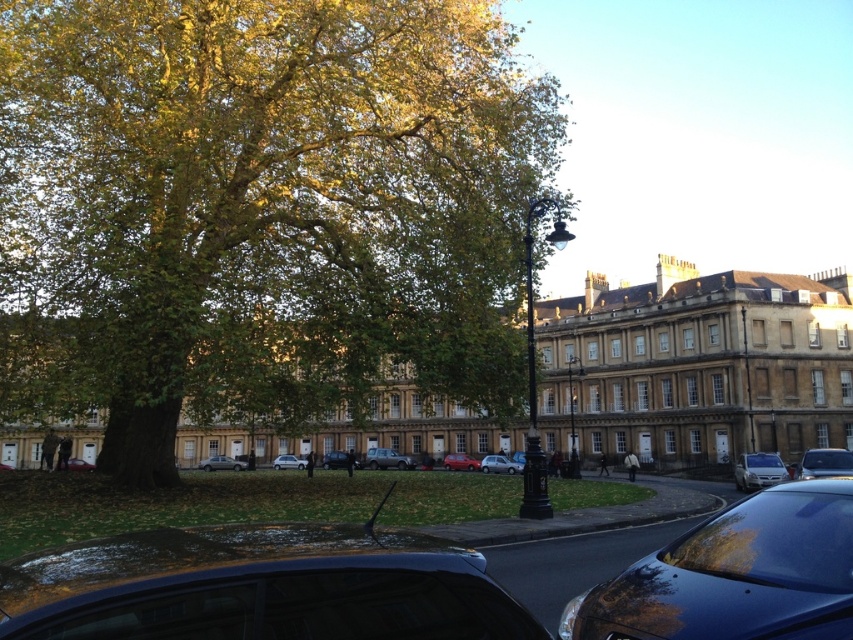
You are a delivery person trying to park your truck between the metallic silver car at lower right and the metallic silver car at center. The truck is 2.5 meters wide. Can you fit your truck in the space between them?

The metallic silver car at lower right might be wider than metallic silver car at center, so the space between them is uncertain. Without knowing the exact width of the cars, it is not possible to determine if the truck can fit.

You are standing at the point with coordinates point (389,464) and want to walk to the point with coordinates point (801,468). According to the scene description, will you pass by the large tree on your left side during your journey?

Yes, you will pass by the large tree on your left side during your journey because point (801,468) is in front of point (389,464), meaning the destination is closer to the viewer than the starting point. Since the large tree dominates the left side of the frame, walking towards a point in front would require moving towards the tree area on the left.